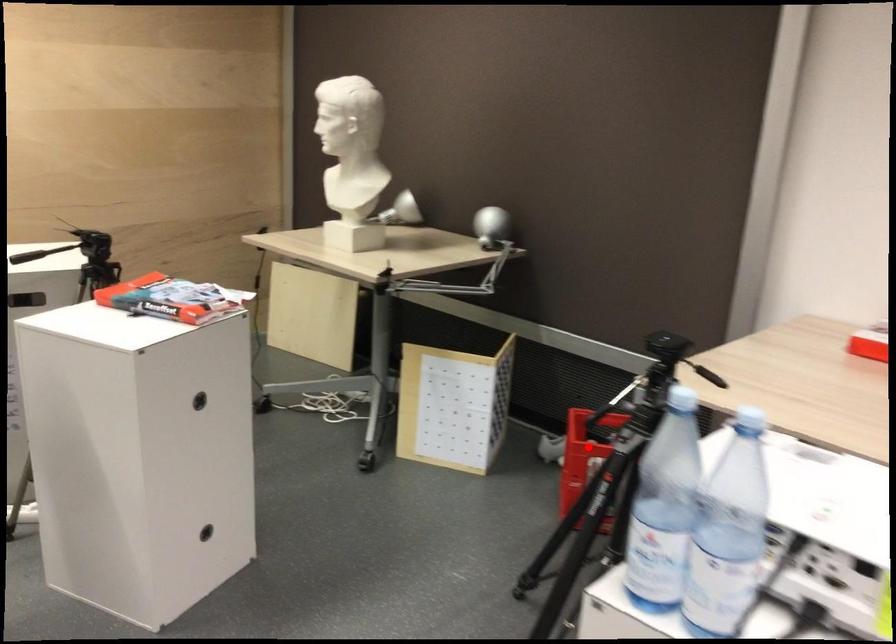
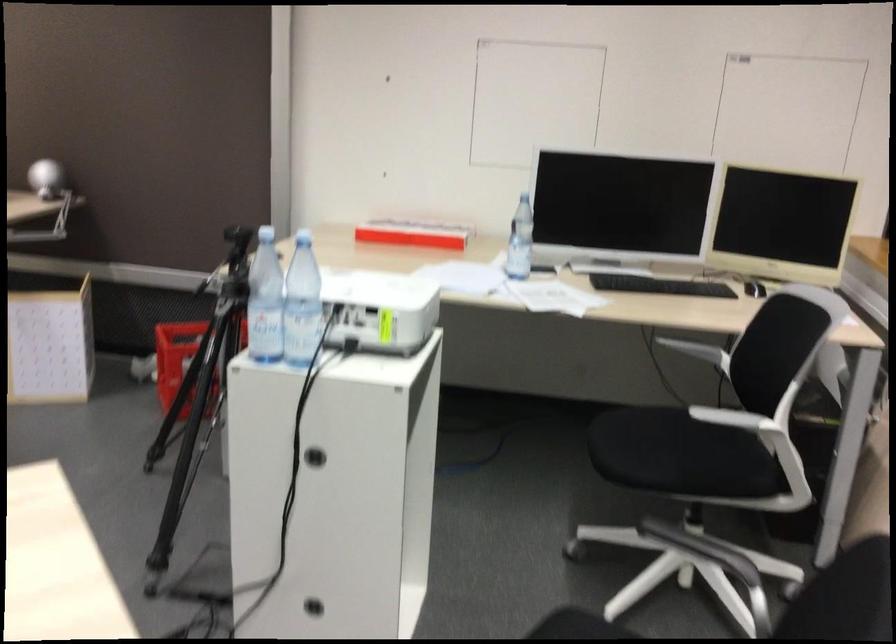
Question: I am providing you with two images of the same scene from different viewpoints. Image1 has a red point marked. In image2, the corresponding 3D location appears at what relative position? Reply with the corresponding letter.

Choices:
 (A) Closer
 (B) Farther

Answer: (B)